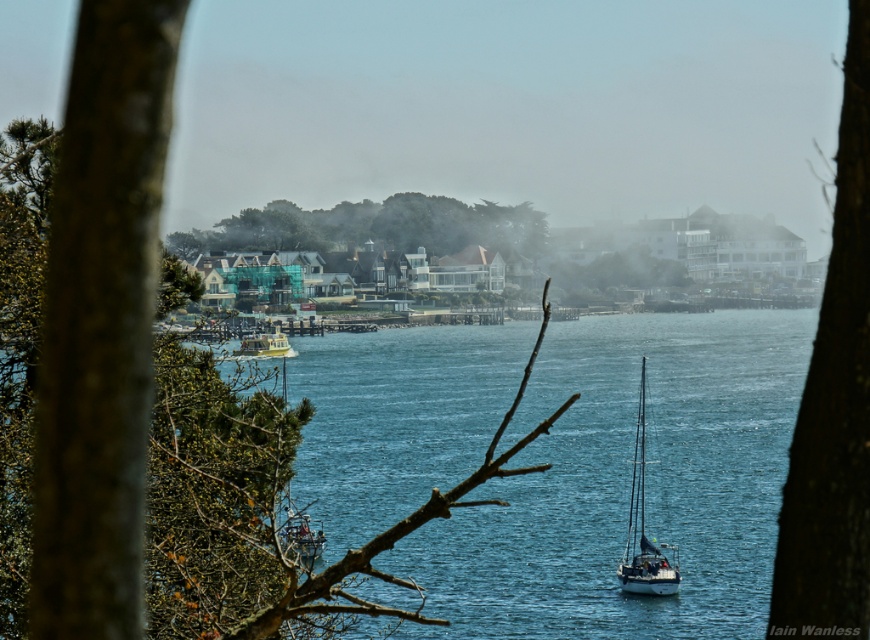
Based on the photo, you are standing at the base of the tree in the coastal scene. There is a point marked at coordinates point (627, 483). What is located at that point?

At point (627, 483) lies blue water at center.

You are standing in front of the tree branches and want to locate the blue water at center. According to the coordinates provided, in which direction should you look relative to the tree branches?

The blue water at center is located at coordinates point (627, 483). Since the coordinates are in the lower right quadrant of the image, you should look towards the lower right direction relative to the tree branches.

You are standing in a coastal area and want to take a photo of the green leafy tree at center and the metallic silver sailboat at center. Which object should you focus on first if you want both to be in sharp focus?

You should focus on the green leafy tree at center first because it is closer to you than the metallic silver sailboat at center. By focusing on the closer object, you increase the chances of both being in focus due to the depth of field.